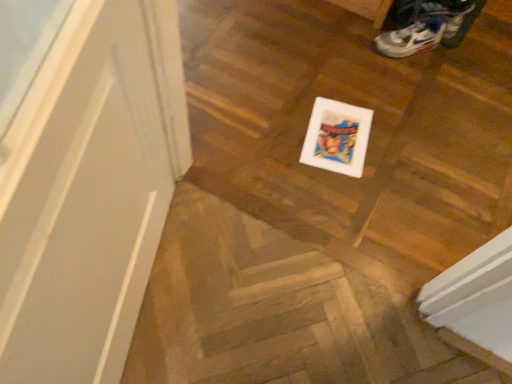
Measure the distance between white mesh shoe at upper right and camera.

white mesh shoe at upper right is 1.65 meters from camera.

The height and width of the screenshot is (384, 512). Describe the element at coordinates (424, 26) in the screenshot. I see `white mesh shoe at upper right` at that location.

Locate an element on the screen. This screenshot has width=512, height=384. white mesh shoe at upper right is located at coordinates (424, 26).

In order to face white mesh shoe at upper right, should I rotate leftwards or rightwards?

Rotate your view right by about 20.367°.

I want to click on wooden floor at center, so click(x=282, y=308).

What do you see at coordinates (282, 308) in the screenshot?
I see `wooden floor at center` at bounding box center [282, 308].

The image size is (512, 384). I want to click on white mesh shoe at upper right, so click(x=424, y=26).

Based on their positions, is white mesh shoe at upper right located to the left or right of wooden floor at center?

white mesh shoe at upper right is positioned on wooden floor at center's right side.

Which is behind, white mesh shoe at upper right or wooden floor at center?

white mesh shoe at upper right is further away from the camera.

Considering the points (451, 11) and (225, 252), which point is in front, point (451, 11) or point (225, 252)?

Point (225, 252)

From the image's perspective, which one is positioned lower, white mesh shoe at upper right or wooden floor at center?

From the image's view, wooden floor at center is below.

From a real-world perspective, who is located higher, white mesh shoe at upper right or wooden floor at center?

From a 3D spatial view, white mesh shoe at upper right is above.

Does white mesh shoe at upper right have a lesser width compared to wooden floor at center?

Yes.

Can you confirm if white mesh shoe at upper right is shorter than wooden floor at center?

No, white mesh shoe at upper right is not shorter than wooden floor at center.

Does white mesh shoe at upper right have a larger size compared to wooden floor at center?

No.

Is wooden floor at center a part of white mesh shoe at upper right?

That's incorrect, wooden floor at center is not inside white mesh shoe at upper right.

Is white mesh shoe at upper right positioned far away from wooden floor at center?

Yes, white mesh shoe at upper right is far from wooden floor at center.

Is white mesh shoe at upper right oriented away from wooden floor at center?

No, wooden floor at center is not at the back of white mesh shoe at upper right.

Measure the distance from white mesh shoe at upper right to wooden floor at center.

The distance of white mesh shoe at upper right from wooden floor at center is 3.49 feet.

In the image, there is a wooden floor at center. At what (x,y) coordinates should I click in order to perform the action: click on footwear above it (from the image's perspective). Please return your answer as a coordinate pair (x, y). The height and width of the screenshot is (384, 512). Looking at the image, I should click on (424, 26).

Considering the positions of objects wooden floor at center and white mesh shoe at upper right in the image provided, who is more to the right, wooden floor at center or white mesh shoe at upper right?

Positioned to the right is white mesh shoe at upper right.

Does wooden floor at center come in front of white mesh shoe at upper right?

That is True.

Does point (208, 377) come behind point (438, 10)?

No, (208, 377) is closer to viewer.

From the image's perspective, is wooden floor at center positioned above or below white mesh shoe at upper right?

Answer: From the image's perspective, wooden floor at center appears below white mesh shoe at upper right.

From a real-world perspective, is wooden floor at center physically above white mesh shoe at upper right?

Incorrect, from a real-world perspective, wooden floor at center is lower than white mesh shoe at upper right.

Considering the sizes of objects wooden floor at center and white mesh shoe at upper right in the image provided, who is wider, wooden floor at center or white mesh shoe at upper right?

wooden floor at center is wider.

Considering the sizes of objects wooden floor at center and white mesh shoe at upper right in the image provided, who is shorter, wooden floor at center or white mesh shoe at upper right?

wooden floor at center.

Considering the sizes of wooden floor at center and white mesh shoe at upper right in the image, is wooden floor at center bigger or smaller than white mesh shoe at upper right?

Considering their sizes, wooden floor at center takes up more space than white mesh shoe at upper right.

Is wooden floor at center surrounding white mesh shoe at upper right?

No, white mesh shoe at upper right is not surrounded by wooden floor at center.

Is wooden floor at center with white mesh shoe at upper right?

No, wooden floor at center is not touching white mesh shoe at upper right.

Could you tell me if wooden floor at center is turned towards white mesh shoe at upper right?

No, wooden floor at center is not aimed at white mesh shoe at upper right.

How many degrees apart are the facing directions of wooden floor at center and white mesh shoe at upper right?

There is a 141-degree angle between the facing directions of wooden floor at center and white mesh shoe at upper right.

Find the location of a particular element. The height and width of the screenshot is (384, 512). stairwell in front of the white mesh shoe at upper right is located at coordinates (282, 308).

Locate an element on the screen. This screenshot has height=384, width=512. footwear that appears on the right of wooden floor at center is located at coordinates (424, 26).

At what (x,y) coordinates should I click in order to perform the action: click on stairwell on the left of white mesh shoe at upper right. Please return your answer as a coordinate pair (x, y). Looking at the image, I should click on (282, 308).